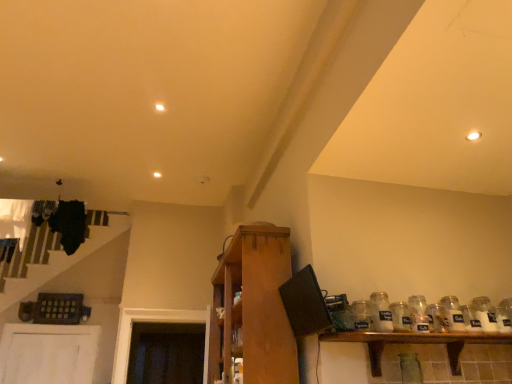
The image size is (512, 384). In order to click on free space in front of white glass jar at right, which is the 3th glass bottle in right-to-left order in this screenshot , I will do `click(385, 333)`.